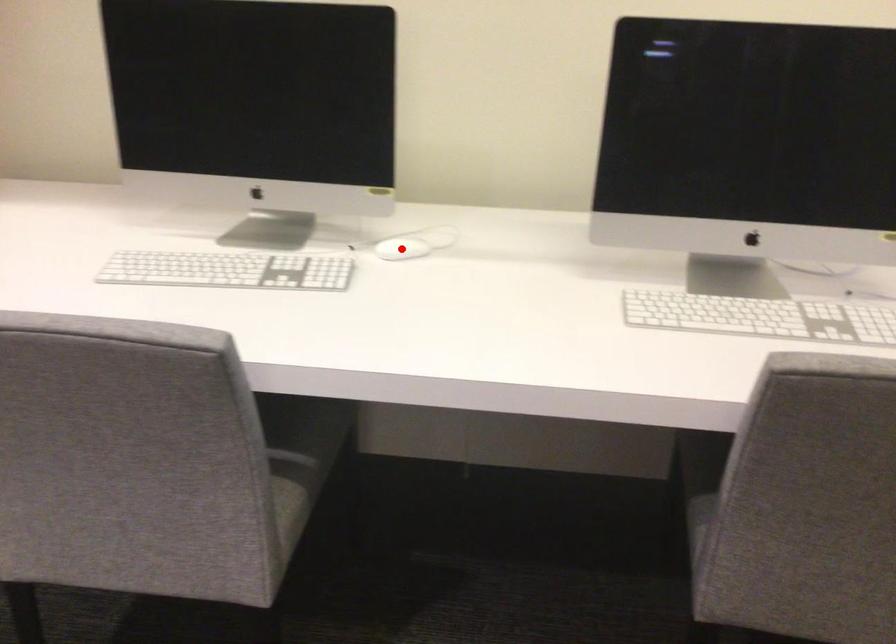
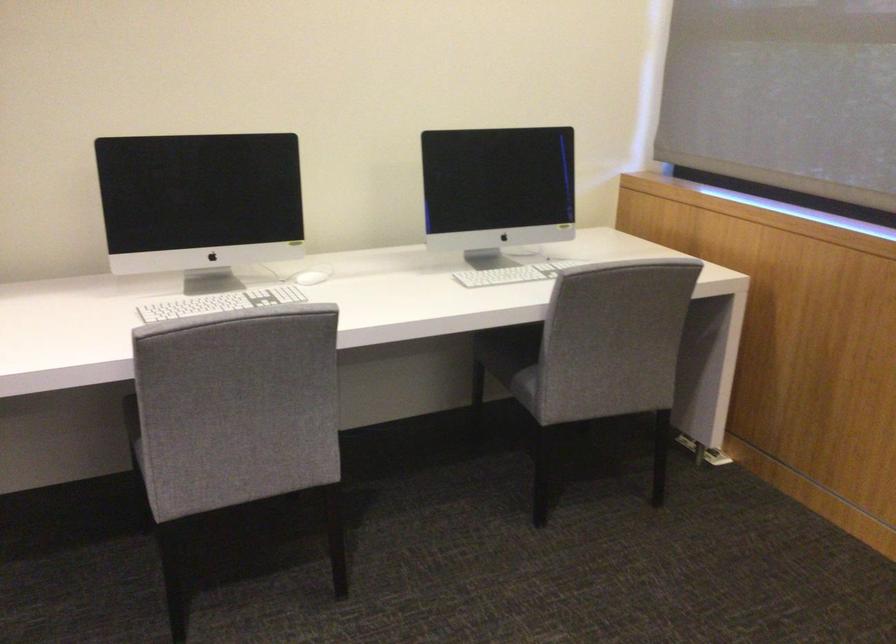
Question: I am providing you with two images of the same scene from different viewpoints. Given a red point in image1, look at the same physical point in image2. Is it:

Choices:
 (A) Closer to the viewpoint
 (B) Farther from the viewpoint

Answer: (B)